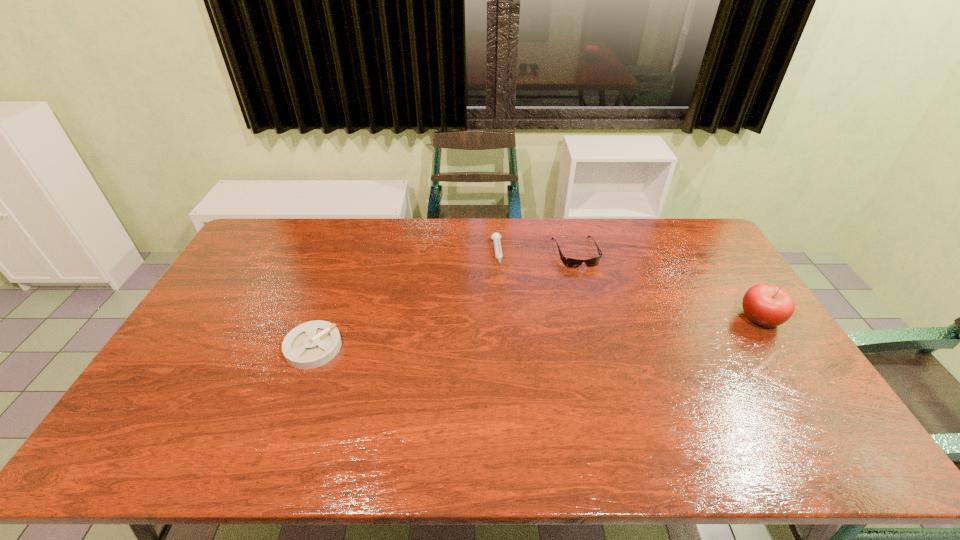
The image size is (960, 540). Find the location of `vacant space at the right edge of the desktop`. vacant space at the right edge of the desktop is located at coordinates (725, 283).

Find the location of a particular element. The width and height of the screenshot is (960, 540). free spot between the sunglasses and the third object from right to left is located at coordinates (537, 253).

Where is `blank region between the syringe and the ashtray`? The height and width of the screenshot is (540, 960). blank region between the syringe and the ashtray is located at coordinates (405, 301).

The height and width of the screenshot is (540, 960). What are the coordinates of `empty location between the second object from left to right and the tallest object` in the screenshot? It's located at (629, 286).

Locate an element on the screen. This screenshot has width=960, height=540. free point between the third object from right to left and the apple is located at coordinates (629, 286).

You are a GUI agent. You are given a task and a screenshot of the screen. Output one action in this format:
    pyautogui.click(x=<x>, y=<y>)
    Task: Click on the empty space that is in between the rightmost object and the ashtray
    
    Given the screenshot: What is the action you would take?
    pyautogui.click(x=537, y=333)

Find the location of `vacant area between the ashtray and the second object from right to left`. vacant area between the ashtray and the second object from right to left is located at coordinates (444, 300).

Locate an element on the screen. The height and width of the screenshot is (540, 960). empty location between the syringe and the tallest object is located at coordinates (629, 286).

The width and height of the screenshot is (960, 540). Find the location of `vacant point located between the second object from right to left and the shortest object`. vacant point located between the second object from right to left and the shortest object is located at coordinates (537, 253).

Image resolution: width=960 pixels, height=540 pixels. Identify the location of free space that is in between the sunglasses and the shortest object. (537, 253).